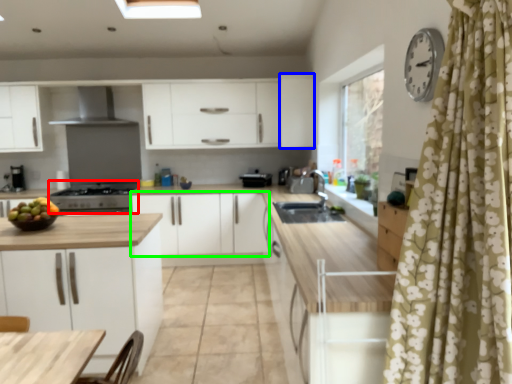
Question: Based on their relative distances, which object is farther from appliance (highlighted by a red box)? Choose from cabinetry (highlighted by a blue box) and cabinetry (highlighted by a green box).

Choices:
 (A) cabinetry
 (B) cabinetry

Answer: (A)